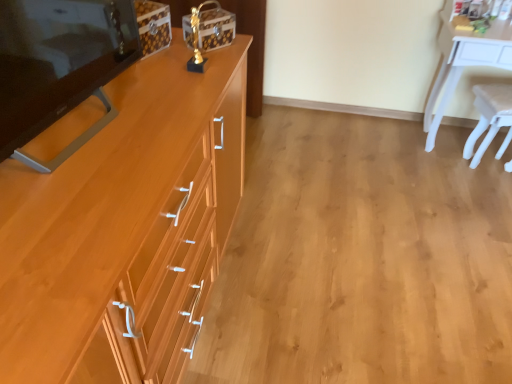
Question: Does white glossy desk at upper right have a greater width compared to wooden drawer at center-left?

Choices:
 (A) yes
 (B) no

Answer: (B)

Question: Is white glossy desk at upper right positioned beyond the bounds of wooden drawer at center-left?

Choices:
 (A) yes
 (B) no

Answer: (A)

Question: Is white glossy desk at upper right oriented towards wooden drawer at center-left?

Choices:
 (A) no
 (B) yes

Answer: (A)

Question: Considering the relative sizes of white glossy desk at upper right and wooden drawer at center-left in the image provided, is white glossy desk at upper right bigger than wooden drawer at center-left?

Choices:
 (A) no
 (B) yes

Answer: (B)

Question: From a real-world perspective, is white glossy desk at upper right physically above wooden drawer at center-left?

Choices:
 (A) yes
 (B) no

Answer: (A)

Question: Is wooden drawer at center-left located within white glossy desk at upper right?

Choices:
 (A) no
 (B) yes

Answer: (A)

Question: Is white plastic chair at right at the left side of light brown wood cabinet at left?

Choices:
 (A) yes
 (B) no

Answer: (B)

Question: Is white plastic chair at right further to camera compared to light brown wood cabinet at left?

Choices:
 (A) no
 (B) yes

Answer: (B)

Question: Considering the relative sizes of white plastic chair at right and light brown wood cabinet at left in the image provided, is white plastic chair at right shorter than light brown wood cabinet at left?

Choices:
 (A) yes
 (B) no

Answer: (A)

Question: From a real-world perspective, is white plastic chair at right located beneath light brown wood cabinet at left?

Choices:
 (A) no
 (B) yes

Answer: (B)

Question: Is white plastic chair at right wider than light brown wood cabinet at left?

Choices:
 (A) yes
 (B) no

Answer: (B)

Question: Is white plastic chair at right far from light brown wood cabinet at left?

Choices:
 (A) no
 (B) yes

Answer: (B)

Question: Is light brown wood cabinet at left oriented away from matte wood changing table at left?

Choices:
 (A) yes
 (B) no

Answer: (B)